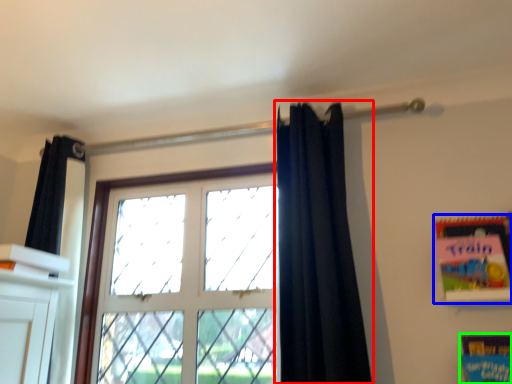
Question: Which object is positioned farthest from curtain (highlighted by a red box)? Select from paperback book (highlighted by a blue box) and paperback book (highlighted by a green box).

Choices:
 (A) paperback book
 (B) paperback book

Answer: (B)